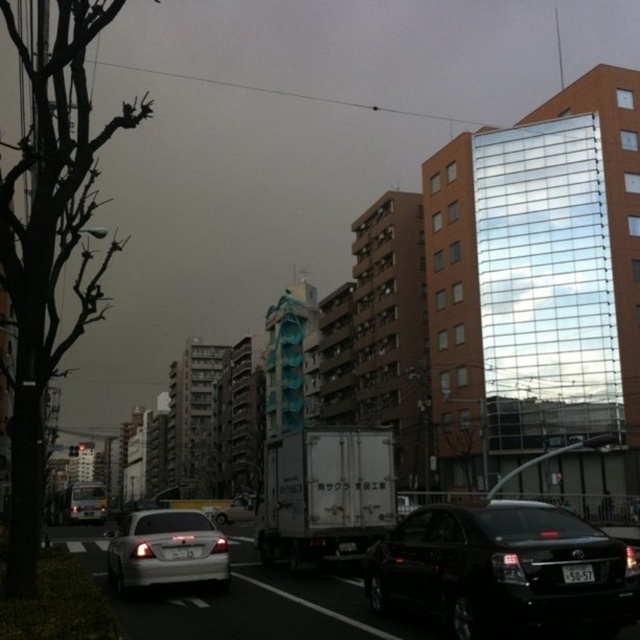
Question: Which point appears farthest from the camera in this image?

Choices:
 (A) (180, 547)
 (B) (177, 540)
 (C) (234, 515)
 (D) (72, 209)

Answer: (C)

Question: Is satin silver sedan at center below white plastic license plate at center?

Choices:
 (A) yes
 (B) no

Answer: (A)

Question: Is black glossy sedan at center to the right of white plastic license plate at center from the viewer's perspective?

Choices:
 (A) no
 (B) yes

Answer: (A)

Question: Does silver metallic car at center lie behind black plastic license plate at center?

Choices:
 (A) yes
 (B) no

Answer: (A)

Question: Which object appears closest to the camera in this image?

Choices:
 (A) satin silver sedan at center
 (B) brown leafless tree at left
 (C) black plastic license plate at center

Answer: (B)

Question: Among these objects, which one is farthest from the camera?

Choices:
 (A) white plastic license plate at center
 (B) black glossy sedan at center
 (C) satin silver sedan at center
 (D) silver metallic car at center

Answer: (D)